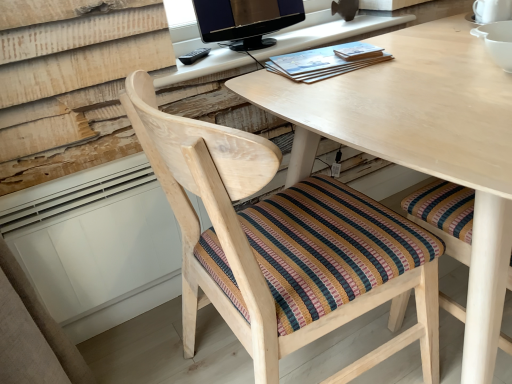
This screenshot has height=384, width=512. What do you see at coordinates (422, 143) in the screenshot?
I see `natural wood computer desk at center, which ranks as the 2th computer desk in top-to-bottom order` at bounding box center [422, 143].

What do you see at coordinates (257, 239) in the screenshot? The width and height of the screenshot is (512, 384). I see `natural wood chair at center` at bounding box center [257, 239].

What do you see at coordinates (245, 20) in the screenshot? The height and width of the screenshot is (384, 512). I see `matte black monitor at upper center` at bounding box center [245, 20].

Identify the location of matte wooden desk at upper center, which ranks as the second computer desk in bottom-to-top order. This screenshot has height=384, width=512. (325, 31).

Which object is positioned more to the right, natural wood chair at center or blue paperback book at center?

blue paperback book at center.

Measure the distance from natural wood chair at center to blue paperback book at center.

natural wood chair at center is 18.65 inches away from blue paperback book at center.

Which object is further away from the camera, natural wood chair at center or blue paperback book at center?

blue paperback book at center.

Locate an element on the screen. The width and height of the screenshot is (512, 384). chair that appears in front of the blue paperback book at center is located at coordinates (257, 239).

You are a GUI agent. You are given a task and a screenshot of the screen. Output one action in this format:
    pyautogui.click(x=<x>, y=<y>)
    Task: Click on the 1st computer desk below the matte black monitor at upper center (from a real-world perspective)
    This screenshot has width=512, height=384.
    Given the screenshot: What is the action you would take?
    pyautogui.click(x=325, y=31)

Is matte wooden desk at upper center, which ranks as the second computer desk in bottom-to-top order, to the right of matte black monitor at upper center from the viewer's perspective?

Correct, you'll find matte wooden desk at upper center, which ranks as the second computer desk in bottom-to-top order, to the right of matte black monitor at upper center.

Is matte wooden desk at upper center, which ranks as the second computer desk in bottom-to-top order, not near matte black monitor at upper center?

No, there isn't a large distance between matte wooden desk at upper center, which ranks as the second computer desk in bottom-to-top order, and matte black monitor at upper center.

From a real-world perspective, is matte wooden desk at upper center, arranged as the 1th computer desk when viewed from the top, on matte black monitor at upper center?

No.

Is natural wood chair at center beside matte wooden desk at upper center, which ranks as the second computer desk in bottom-to-top order?

No, natural wood chair at center is not touching matte wooden desk at upper center, which ranks as the second computer desk in bottom-to-top order.

From a real-world perspective, who is located higher, natural wood chair at center or matte wooden desk at upper center, which ranks as the second computer desk in bottom-to-top order?

matte wooden desk at upper center, which ranks as the second computer desk in bottom-to-top order, from a real-world perspective.

Does natural wood chair at center have a greater width compared to matte wooden desk at upper center, which ranks as the second computer desk in bottom-to-top order?

Yes.

Find the location of `computer desk that is the 2nd object located above the natural wood chair at center (from the image's perspective)`. computer desk that is the 2nd object located above the natural wood chair at center (from the image's perspective) is located at coordinates (325, 31).

How many degrees apart are the facing directions of natural wood computer desk at center, which ranks as the first computer desk in bottom-to-top order, and natural wood chair at center?

natural wood computer desk at center, which ranks as the first computer desk in bottom-to-top order, and natural wood chair at center are facing 87.8 degrees away from each other.

Is natural wood computer desk at center, which ranks as the 2th computer desk in top-to-bottom order, looking in the opposite direction of natural wood chair at center?

natural wood computer desk at center, which ranks as the 2th computer desk in top-to-bottom order, does not have its back to natural wood chair at center.

Identify the location of computer desk below the natural wood chair at center (from a real-world perspective). This screenshot has width=512, height=384. (422, 143).

Is natural wood chair at center surrounded by natural wood computer desk at center, which ranks as the first computer desk in bottom-to-top order?

That's correct, natural wood chair at center is inside natural wood computer desk at center, which ranks as the first computer desk in bottom-to-top order.

Is natural wood chair at center looking in the opposite direction of natural wood computer desk at center, which ranks as the first computer desk in bottom-to-top order?

natural wood chair at center is not turned away from natural wood computer desk at center, which ranks as the first computer desk in bottom-to-top order.

Between point (188, 284) and point (479, 81), which one is positioned behind?

The point (188, 284) is behind.

Find the location of `chair in front of the natural wood computer desk at center, which ranks as the first computer desk in bottom-to-top order`. chair in front of the natural wood computer desk at center, which ranks as the first computer desk in bottom-to-top order is located at coordinates (257, 239).

From the picture: Considering the positions of objects natural wood chair at center and natural wood computer desk at center, which ranks as the 2th computer desk in top-to-bottom order, in the image provided, who is behind, natural wood chair at center or natural wood computer desk at center, which ranks as the 2th computer desk in top-to-bottom order,?

natural wood computer desk at center, which ranks as the 2th computer desk in top-to-bottom order, is further from the camera.

Is natural wood computer desk at center, which ranks as the 2th computer desk in top-to-bottom order, aimed at matte black monitor at upper center?

No.

From a real-world perspective, is natural wood computer desk at center, which ranks as the 2th computer desk in top-to-bottom order, physically below matte black monitor at upper center?

Yes, from a real-world perspective, natural wood computer desk at center, which ranks as the 2th computer desk in top-to-bottom order, is below matte black monitor at upper center.

From the image's perspective, which is above, natural wood computer desk at center, which ranks as the 2th computer desk in top-to-bottom order, or matte black monitor at upper center?

matte black monitor at upper center appears higher in the image.

Do you think natural wood computer desk at center, which ranks as the 2th computer desk in top-to-bottom order, is within matte black monitor at upper center, or outside of it?

natural wood computer desk at center, which ranks as the 2th computer desk in top-to-bottom order, cannot be found inside matte black monitor at upper center.

Is matte black monitor at upper center to the right of natural wood chair at center from the viewer's perspective?

No.

Where is `chair beneath the matte black monitor at upper center (from a real-world perspective)`? This screenshot has height=384, width=512. chair beneath the matte black monitor at upper center (from a real-world perspective) is located at coordinates (257, 239).

Where is `chair below the blue paperback book at center (from a real-world perspective)`? chair below the blue paperback book at center (from a real-world perspective) is located at coordinates (257, 239).

Locate an element on the screen. television above the matte wooden desk at upper center, arranged as the 1th computer desk when viewed from the top (from the image's perspective) is located at coordinates (245, 20).

Looking at this image, based on their spatial positions, is blue paperback book at center or natural wood computer desk at center, which ranks as the first computer desk in bottom-to-top order, closer to matte wooden desk at upper center, which ranks as the second computer desk in bottom-to-top order?

Among the two, blue paperback book at center is located nearer to matte wooden desk at upper center, which ranks as the second computer desk in bottom-to-top order.

From the image, which object appears to be farther from blue paperback book at center, natural wood chair at center or natural wood computer desk at center, which ranks as the 2th computer desk in top-to-bottom order?

natural wood chair at center lies further to blue paperback book at center than the other object.

Looking at the image, which one is located closer to matte wooden desk at upper center, which ranks as the second computer desk in bottom-to-top order, blue paperback book at center or matte black monitor at upper center?

Based on the image, matte black monitor at upper center appears to be nearer to matte wooden desk at upper center, which ranks as the second computer desk in bottom-to-top order.

Based on their spatial positions, is natural wood computer desk at center, which ranks as the first computer desk in bottom-to-top order, or matte black monitor at upper center closer to matte wooden desk at upper center, arranged as the 1th computer desk when viewed from the top?

Based on the image, matte black monitor at upper center appears to be nearer to matte wooden desk at upper center, arranged as the 1th computer desk when viewed from the top.

Looking at the image, which one is located closer to natural wood computer desk at center, which ranks as the first computer desk in bottom-to-top order, natural wood chair at center or matte wooden desk at upper center, arranged as the 1th computer desk when viewed from the top?

The object closer to natural wood computer desk at center, which ranks as the first computer desk in bottom-to-top order, is natural wood chair at center.

Considering their positions, is natural wood computer desk at center, which ranks as the 2th computer desk in top-to-bottom order, positioned closer to matte black monitor at upper center than natural wood chair at center?

natural wood computer desk at center, which ranks as the 2th computer desk in top-to-bottom order.

Based on the photo, based on their spatial positions, is natural wood chair at center or matte wooden desk at upper center, arranged as the 1th computer desk when viewed from the top, further from blue paperback book at center?

Based on the image, natural wood chair at center appears to be further to blue paperback book at center.

Based on the photo, based on their spatial positions, is blue paperback book at center or matte black monitor at upper center further from natural wood computer desk at center, which ranks as the first computer desk in bottom-to-top order?

Based on the image, matte black monitor at upper center appears to be further to natural wood computer desk at center, which ranks as the first computer desk in bottom-to-top order.

Locate an element on the screen. Image resolution: width=512 pixels, height=384 pixels. computer desk situated between matte black monitor at upper center and natural wood computer desk at center, which ranks as the 2th computer desk in top-to-bottom order, from left to right is located at coordinates (325, 31).

Where is `book positioned between natural wood chair at center and matte wooden desk at upper center, which ranks as the second computer desk in bottom-to-top order, from near to far`? This screenshot has width=512, height=384. book positioned between natural wood chair at center and matte wooden desk at upper center, which ranks as the second computer desk in bottom-to-top order, from near to far is located at coordinates (326, 61).

Image resolution: width=512 pixels, height=384 pixels. Identify the location of book located between natural wood chair at center and natural wood computer desk at center, which ranks as the 2th computer desk in top-to-bottom order, in the left-right direction. (326, 61).

You are a GUI agent. You are given a task and a screenshot of the screen. Output one action in this format:
    pyautogui.click(x=<x>, y=<y>)
    Task: Click on the chair between matte black monitor at upper center and natural wood computer desk at center, which ranks as the 2th computer desk in top-to-bottom order
    
    Given the screenshot: What is the action you would take?
    pyautogui.click(x=257, y=239)